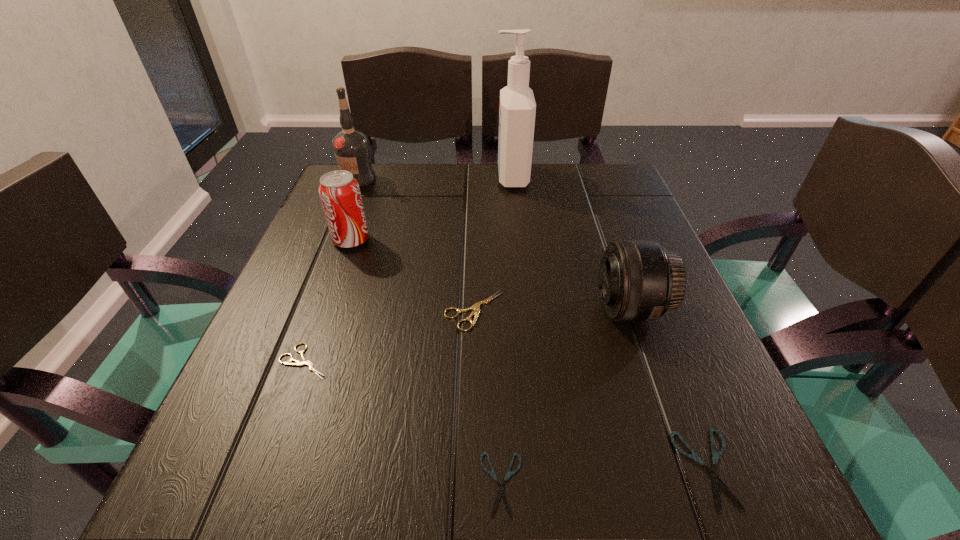
Locate an element on the screen. free spot between the right black shears and the shortest shears is located at coordinates (605, 477).

The height and width of the screenshot is (540, 960). Identify the location of empty location between the sixth nearest object and the farthest shears. (413, 275).

The width and height of the screenshot is (960, 540). What are the coordinates of `free space between the telephoto lens and the seventh shortest object` in the screenshot? It's located at (494, 244).

At what (x,y) coordinates should I click in order to perform the action: click on free spot between the telephoto lens and the right black shears. Please return your answer as a coordinate pair (x, y). Looking at the image, I should click on (669, 389).

Where is `free space between the telephoto lens and the cleansing agent`? The height and width of the screenshot is (540, 960). free space between the telephoto lens and the cleansing agent is located at coordinates (571, 243).

Identify the location of vacant area that lies between the third nearest object and the vodka. (331, 270).

The width and height of the screenshot is (960, 540). Identify the location of free space between the left black shears and the third farthest object. coord(426,362).

The height and width of the screenshot is (540, 960). What are the coordinates of `free space between the tallest shears and the telephoto lens` in the screenshot? It's located at (552, 309).

Locate an element on the screen. This screenshot has height=540, width=960. empty space that is in between the cleansing agent and the soda can is located at coordinates (431, 208).

The height and width of the screenshot is (540, 960). I want to click on free point between the smaller beige shears and the right black shears, so click(507, 415).